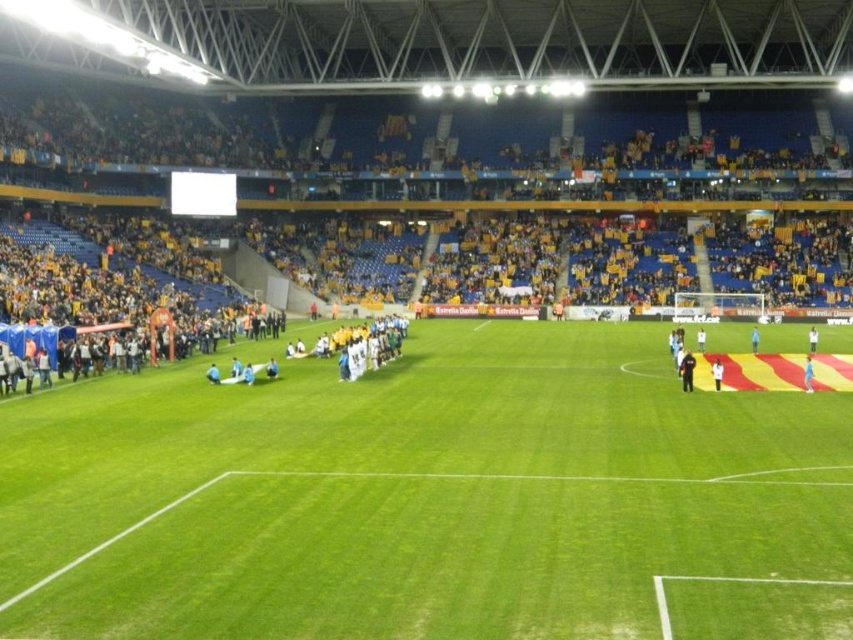
Question: Does green grass football field at center have a greater width compared to black uniformed official at center?

Choices:
 (A) yes
 (B) no

Answer: (A)

Question: Estimate the real-world distances between objects in this image. Which object is farther from the white cotton shirt at center?

Choices:
 (A) black uniformed official at center
 (B) white fabric person at center
 (C) blue fabric at center

Answer: (B)

Question: Does blue fabric at center have a smaller size compared to blue fabric person at center?

Choices:
 (A) no
 (B) yes

Answer: (B)

Question: Which of the following is the closest to the observer?

Choices:
 (A) (28, 605)
 (B) (714, 371)

Answer: (A)

Question: Does black uniformed official at center come in front of white fabric person at center?

Choices:
 (A) no
 (B) yes

Answer: (B)

Question: Which object appears farthest from the camera in this image?

Choices:
 (A) white cotton shirt at center
 (B) black uniformed official at center
 (C) blue fabric at center

Answer: (A)